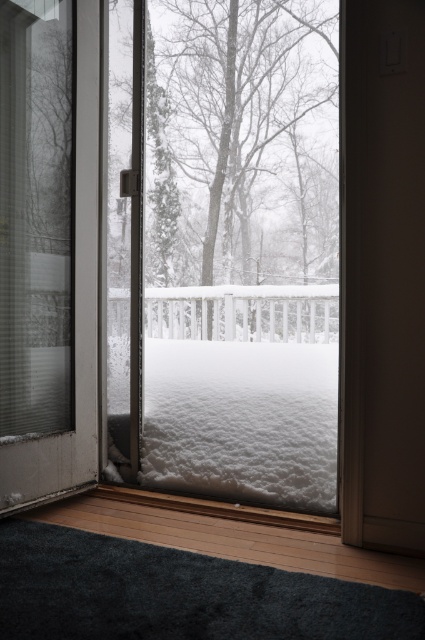
You are standing inside the room and want to exit through the brown matte door at center. There is a white wooden rail at center outside. Which object will you encounter first when exiting the room?

The brown matte door at center is closer to the viewer than the white wooden rail at center, so you will encounter the brown matte door at center first when exiting the room.

You are standing in the room looking through the glass door. There are two points marked on the snow outside. One is at coordinate point (221,232) and the other at point (416,301). Which point is closer to the camera?

Point (221,232) is further to the camera than point (416,301), so the point closer to the camera is point (416,301).

You are standing in the room and want to exit through the brown matte door at center. Based on the coordinates provided, can you determine if the door is positioned centrally in the room?

The brown matte door at center is located at coordinates point [382,275], which suggests it is positioned centrally in the room.